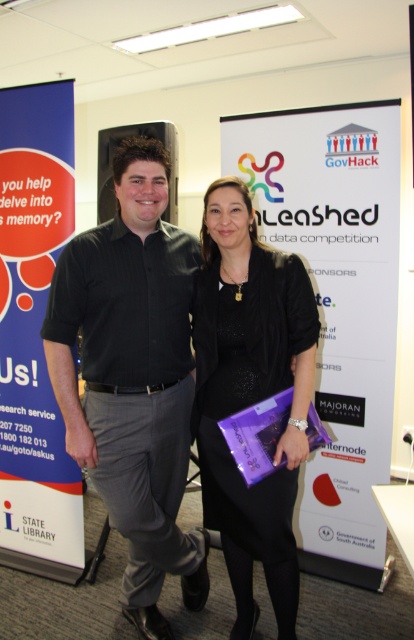
Which is above, black glossy shirt at left or black satin dress at center?

black glossy shirt at left

The height and width of the screenshot is (640, 414). In order to click on black glossy shirt at left in this screenshot , I will do `click(132, 378)`.